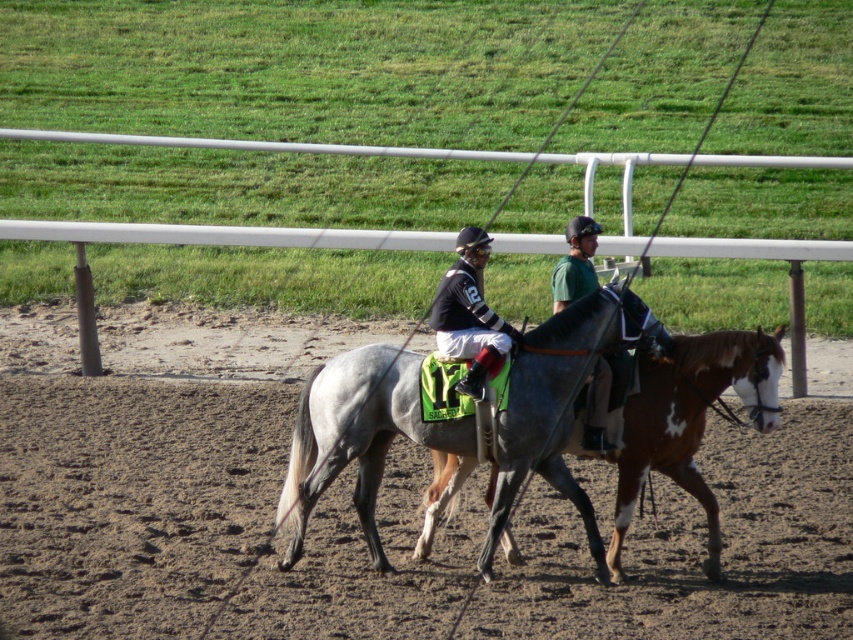
Does gray glossy horse at center lie behind matte black jockey at center?

No, gray glossy horse at center is in front of matte black jockey at center.

The width and height of the screenshot is (853, 640). Describe the element at coordinates (357, 436) in the screenshot. I see `gray glossy horse at center` at that location.

Locate an element on the screen. The width and height of the screenshot is (853, 640). gray glossy horse at center is located at coordinates point(357,436).

Does gray glossy horse at center appear on the left side of shiny black horse at center?

Indeed, gray glossy horse at center is positioned on the left side of shiny black horse at center.

Between point (563, 349) and point (583, 230), which one is positioned behind?

The point (583, 230) is more distant.

Find the location of a particular element. The height and width of the screenshot is (640, 853). gray glossy horse at center is located at coordinates (357, 436).

Find the location of `gray glossy horse at center`. gray glossy horse at center is located at coordinates (357, 436).

Does gray glossy horse at center lie behind gray matte/satin horse at center?

Yes, gray glossy horse at center is behind gray matte/satin horse at center.

Is gray glossy horse at center above gray matte/satin horse at center?

Actually, gray glossy horse at center is below gray matte/satin horse at center.

This screenshot has width=853, height=640. I want to click on gray glossy horse at center, so click(357, 436).